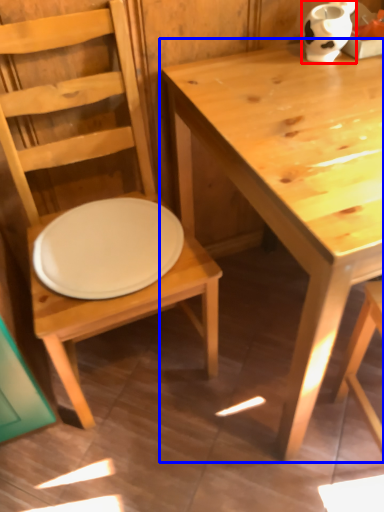
Question: Which object appears farthest to the camera in this image, vase (highlighted by a red box) or table (highlighted by a blue box)?

Choices:
 (A) vase
 (B) table

Answer: (A)